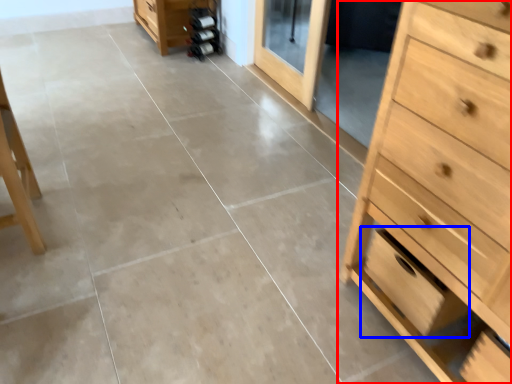
Question: Which object is further to the camera taking this photo, chest of drawers (highlighted by a red box) or drawer (highlighted by a blue box)?

Choices:
 (A) chest of drawers
 (B) drawer

Answer: (B)